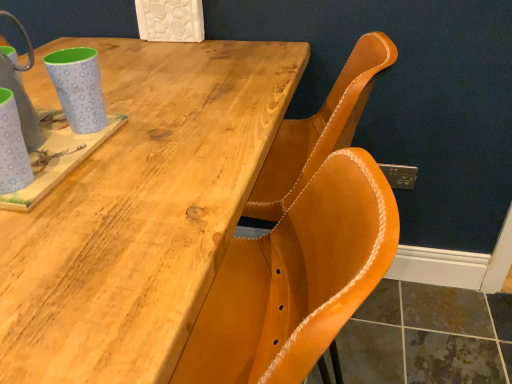
I want to click on unoccupied region to the right of matte blue cup at left, acting as the 1th mug starting from the front, so click(116, 190).